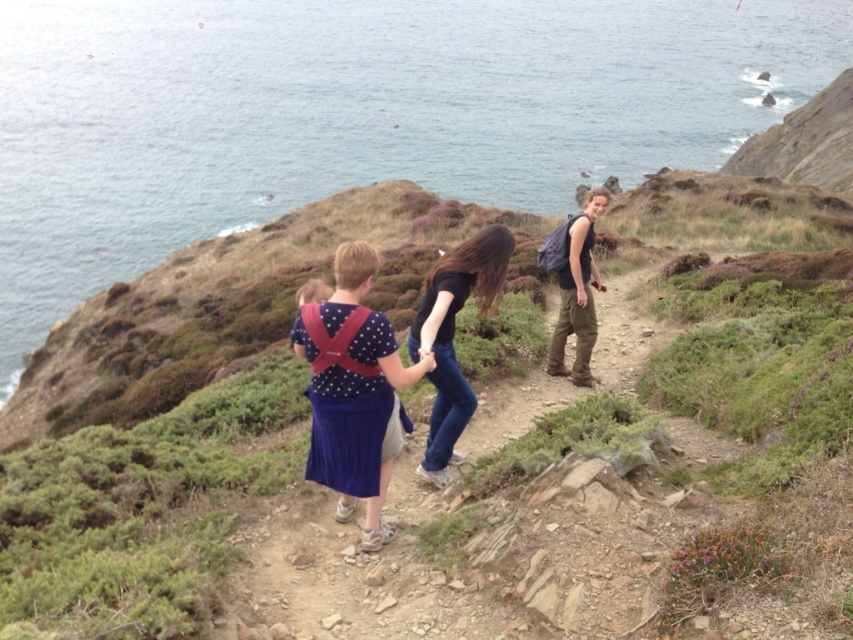
Between blue water at upper left and polka dot fabric dress at center, which one appears on the right side from the viewer's perspective?

polka dot fabric dress at center is more to the right.

Does point (628, 17) lie behind point (364, 333)?

Yes, it is.

Does point (148, 12) come behind point (326, 413)?

Yes, point (148, 12) is farther from viewer.

This screenshot has width=853, height=640. Identify the location of blue water at upper left. (354, 113).

The image size is (853, 640). What do you see at coordinates (352, 390) in the screenshot?
I see `polka dot fabric baby carrier at center` at bounding box center [352, 390].

Can you confirm if polka dot fabric baby carrier at center is taller than black matte shirt at center?

Correct, polka dot fabric baby carrier at center is much taller as black matte shirt at center.

Where is `polka dot fabric baby carrier at center`? polka dot fabric baby carrier at center is located at coordinates (352, 390).

Between blue water at upper left and black matte shirt at center, which one is positioned lower?

Positioned lower is black matte shirt at center.

Is blue water at upper left thinner than black matte shirt at center?

No.

Between point (451, 106) and point (442, 397), which one is positioned behind?

Positioned behind is point (451, 106).

Find the location of `blue water at upper left`. blue water at upper left is located at coordinates (354, 113).